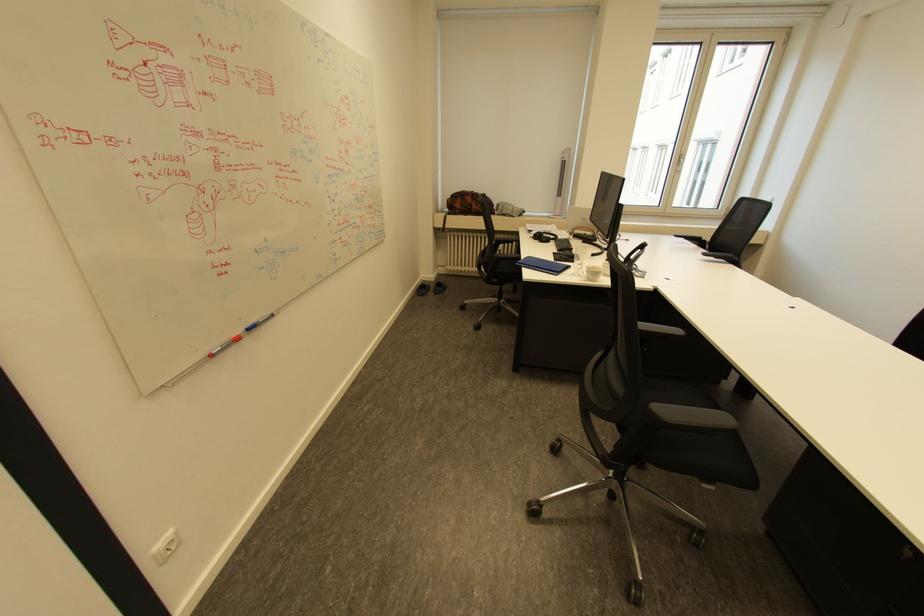
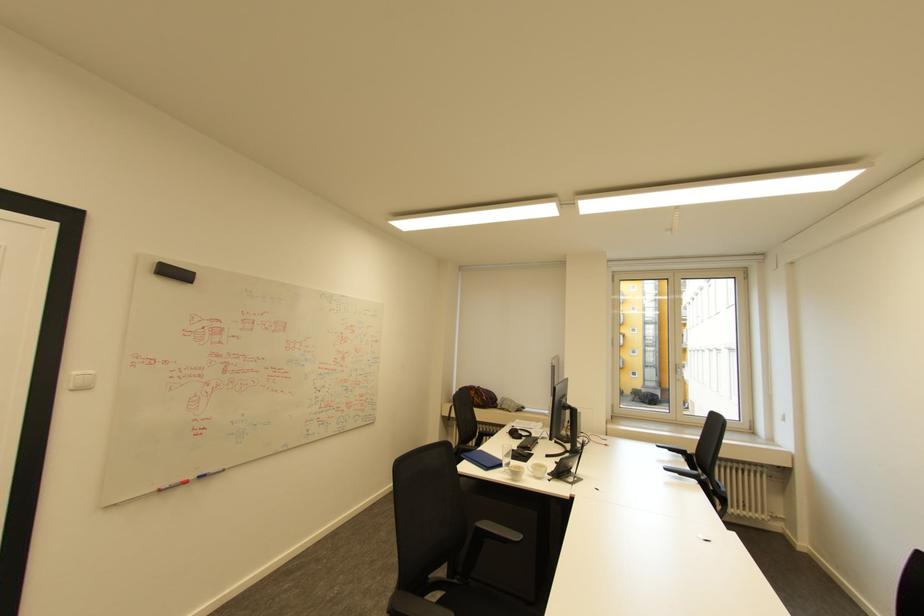
In the second image, find the point that corresponds to the point at 687,155 in the first image.

(683, 365)